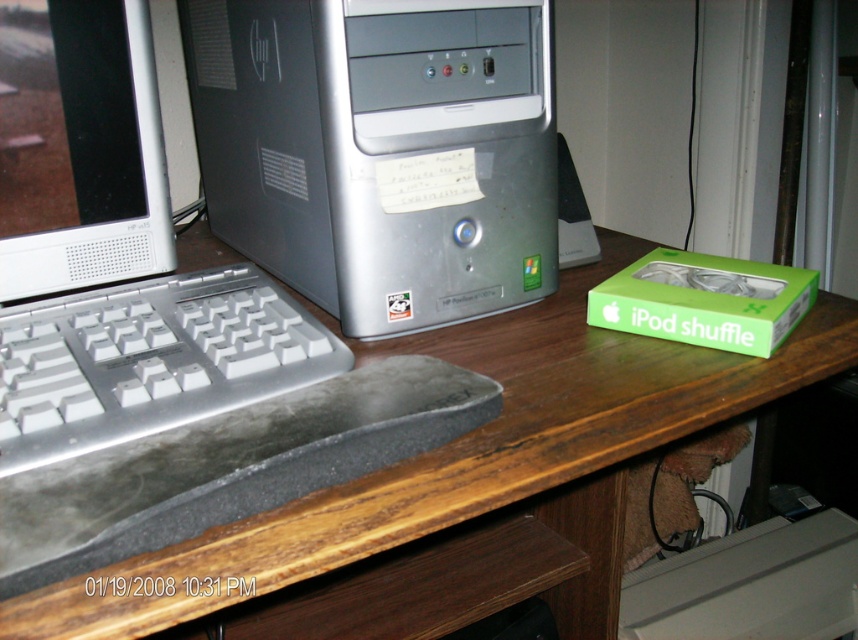
Is wooden at center to the left of green matte ipod shuffle box at right from the viewer's perspective?

Indeed, wooden at center is positioned on the left side of green matte ipod shuffle box at right.

Between point (361, 532) and point (796, 285), which one is positioned in front?

Point (361, 532)

Locate an element on the screen. This screenshot has height=640, width=858. wooden at center is located at coordinates (469, 449).

What do you see at coordinates (379, 150) in the screenshot? The width and height of the screenshot is (858, 640). I see `silver metallic computer tower at center` at bounding box center [379, 150].

Is silver metallic computer tower at center to the right of white plastic computer monitor at left from the viewer's perspective?

Indeed, silver metallic computer tower at center is positioned on the right side of white plastic computer monitor at left.

Is point (502, 116) more distant than point (77, 81)?

That is True.

The height and width of the screenshot is (640, 858). Identify the location of silver metallic computer tower at center. (379, 150).

Between white plastic computer monitor at left and green matte ipod shuffle box at right, which one appears on the left side from the viewer's perspective?

Positioned to the left is white plastic computer monitor at left.

You are a GUI agent. You are given a task and a screenshot of the screen. Output one action in this format:
    pyautogui.click(x=<x>, y=<y>)
    Task: Click on the white plastic computer monitor at left
    The image size is (858, 640).
    Given the screenshot: What is the action you would take?
    pyautogui.click(x=79, y=147)

Which is in front, point (150, 266) or point (701, 316)?

Point (701, 316) is more forward.

Identify the location of white plastic computer monitor at left. (79, 147).